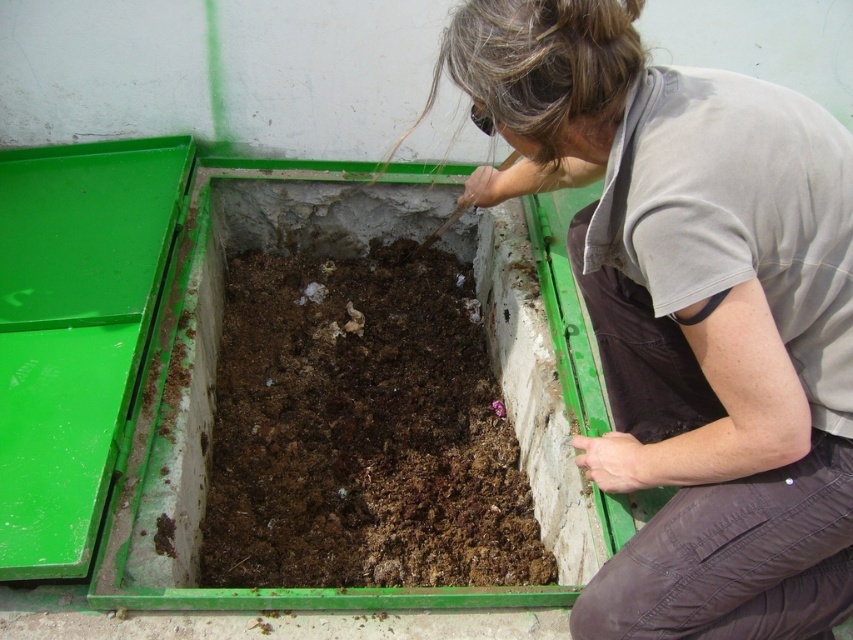
You are standing in front of the compost container and need to reach two points marked on the container. The first point is at coordinate point(816, 524) and the second is at point(486, 358). Which point is closer to you?

Point(816, 524) is closer to the viewer than point(486, 358), so the first point is closer.

Where is the gray fabric shirt at center located in the image?

The gray fabric shirt at center is located at point 0.487 on the x axis and 0.804 on the y axis.